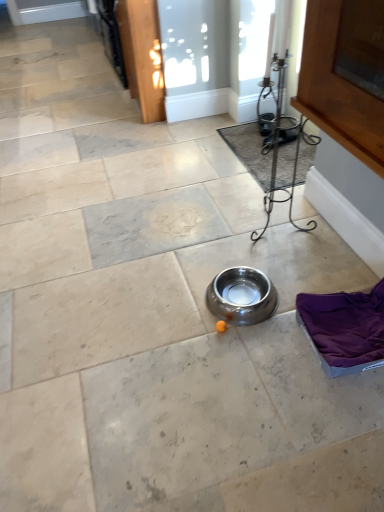
Question: Is silver metallic bowl at center not close to carpeted mat at center?

Choices:
 (A) yes
 (B) no

Answer: (B)

Question: Is silver metallic bowl at center located outside carpeted mat at center?

Choices:
 (A) yes
 (B) no

Answer: (A)

Question: Are silver metallic bowl at center and carpeted mat at center making contact?

Choices:
 (A) yes
 (B) no

Answer: (B)

Question: From the image's perspective, would you say silver metallic bowl at center is positioned over carpeted mat at center?

Choices:
 (A) no
 (B) yes

Answer: (A)

Question: Is silver metallic bowl at center at the right side of carpeted mat at center?

Choices:
 (A) no
 (B) yes

Answer: (A)

Question: From a real-world perspective, is silver metallic bowl at center on carpeted mat at center?

Choices:
 (A) yes
 (B) no

Answer: (A)

Question: Would you say silver metallic bowl at center is part of carpeted mat at center's contents?

Choices:
 (A) yes
 (B) no

Answer: (B)

Question: Can you confirm if carpeted mat at center is shorter than silver metallic bowl at center?

Choices:
 (A) no
 (B) yes

Answer: (B)

Question: From the image's perspective, does carpeted mat at center appear higher than silver metallic bowl at center?

Choices:
 (A) no
 (B) yes

Answer: (B)

Question: Can you confirm if carpeted mat at center is wider than silver metallic bowl at center?

Choices:
 (A) no
 (B) yes

Answer: (B)

Question: From the image's perspective, is carpeted mat at center beneath silver metallic bowl at center?

Choices:
 (A) no
 (B) yes

Answer: (A)

Question: Considering the relative sizes of carpeted mat at center and silver metallic bowl at center in the image provided, is carpeted mat at center bigger than silver metallic bowl at center?

Choices:
 (A) no
 (B) yes

Answer: (B)

Question: In terms of size, does silver metallic bowl at center appear bigger or smaller than carpeted mat at center?

Choices:
 (A) small
 (B) big

Answer: (A)